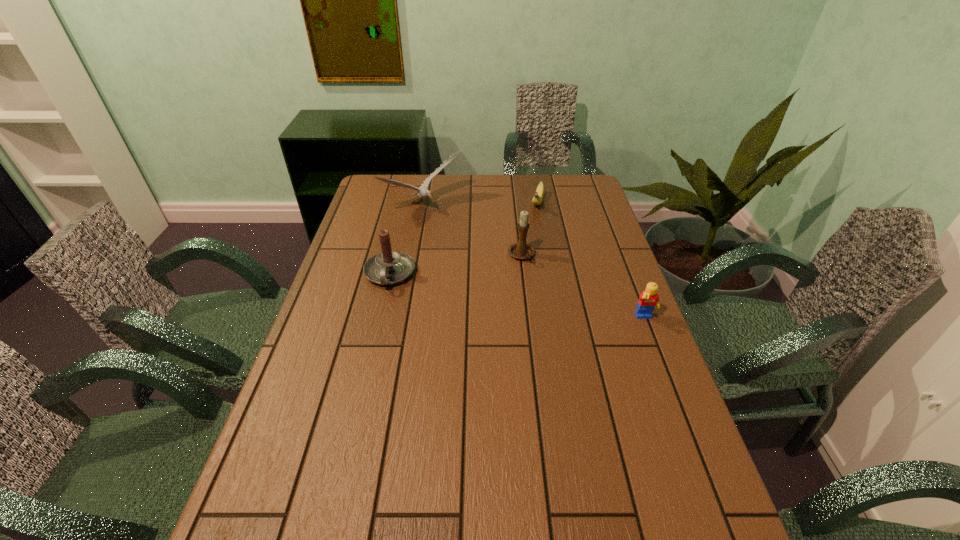
The width and height of the screenshot is (960, 540). Find the location of `candle at the left edge`. candle at the left edge is located at coordinates (389, 267).

You are a GUI agent. You are given a task and a screenshot of the screen. Output one action in this format:
    pyautogui.click(x=<x>, y=<y>)
    Task: Click on the gull that is positioned at the left edge
    The width and height of the screenshot is (960, 540).
    Given the screenshot: What is the action you would take?
    pyautogui.click(x=423, y=191)

Identify the location of object that is at the right edge. (648, 300).

This screenshot has width=960, height=540. In order to click on object at the far left corner in this screenshot , I will do `click(423, 191)`.

Locate an element on the screen. free spot at the far edge of the desktop is located at coordinates (420, 178).

You are a GUI agent. You are given a task and a screenshot of the screen. Output one action in this format:
    pyautogui.click(x=<x>, y=<y>)
    Task: Click on the free space at the near edge
    This screenshot has width=960, height=540.
    Given the screenshot: What is the action you would take?
    pyautogui.click(x=391, y=477)

This screenshot has height=540, width=960. What are the coordinates of `blank area at the left edge` in the screenshot? It's located at pos(359,322).

You are a GUI agent. You are given a task and a screenshot of the screen. Output one action in this format:
    pyautogui.click(x=<x>, y=<y>)
    Task: Click on the vacant point at the right edge
    
    Given the screenshot: What is the action you would take?
    pyautogui.click(x=628, y=393)

The width and height of the screenshot is (960, 540). In the image, there is a desktop. Identify the location of vacant space at the near left corner. (300, 498).

The width and height of the screenshot is (960, 540). Find the location of `blank space at the far right corner of the desktop`. blank space at the far right corner of the desktop is located at coordinates (579, 186).